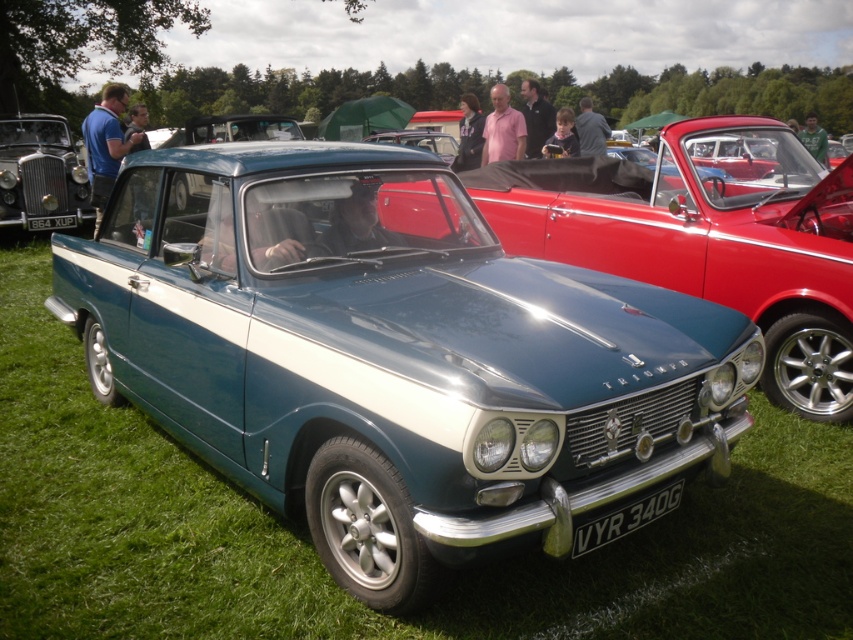
Question: Does metallic blue car at center lie in front of teal metallic car at center?

Choices:
 (A) no
 (B) yes

Answer: (B)

Question: Does metallic teal car at center have a larger size compared to black metal license plate at lower center?

Choices:
 (A) yes
 (B) no

Answer: (A)

Question: Among these objects, which one is farthest from the camera?

Choices:
 (A) metallic teal car at center
 (B) matte black car at left
 (C) teal metallic car at center
 (D) black metal license plate at lower center

Answer: (B)

Question: Which object is positioned closest to the matte black car at left?

Choices:
 (A) black metal license plate at lower center
 (B) metallic blue car at center
 (C) teal metallic car at center
 (D) metallic teal car at center

Answer: (C)

Question: In this image, where is metallic blue car at center located relative to matte black car at left?

Choices:
 (A) right
 (B) left

Answer: (A)

Question: Considering the real-world distances, which object is closest to the metallic teal car at center?

Choices:
 (A) metallic blue car at center
 (B) black metal license plate at lower center

Answer: (B)